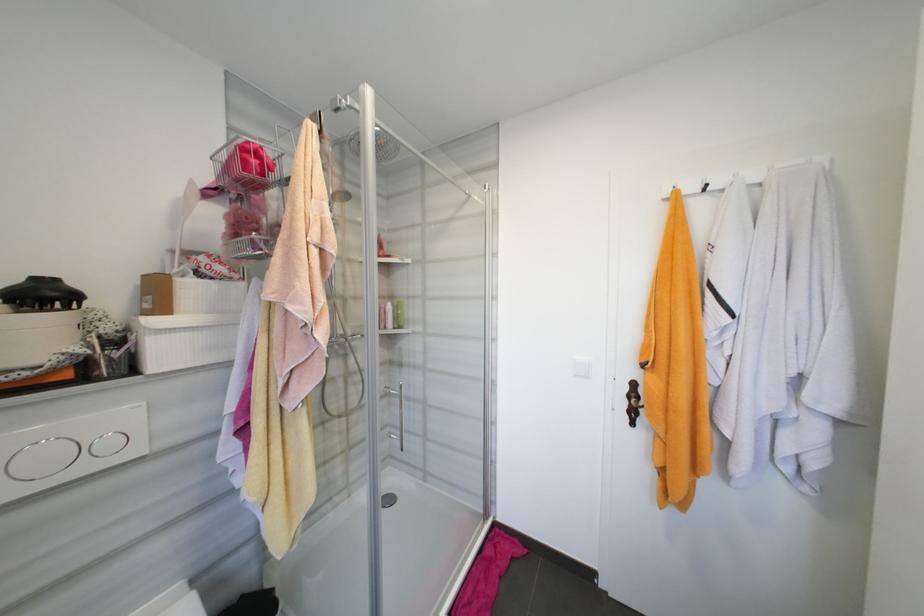
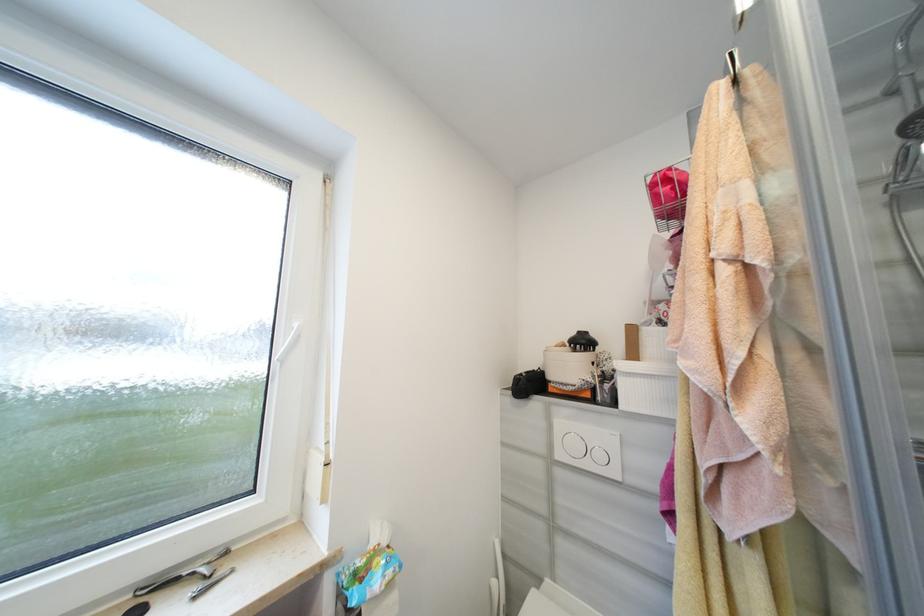
Question: The camera is either moving clockwise (left) or counter-clockwise (right) around the object. The first image is from the beginning of the video and the second image is from the end. Is the camera moving left or right when shooting the video?

Choices:
 (A) Left
 (B) Right

Answer: (B)